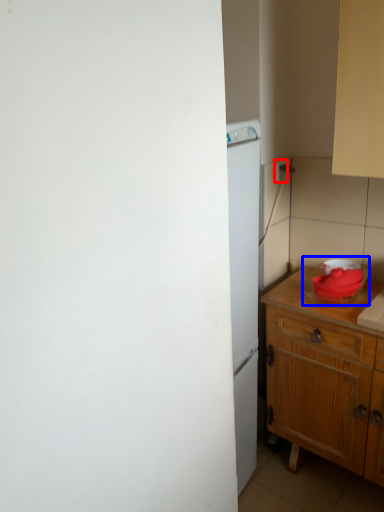
Question: Which object is closer to the camera taking this photo, electric outlet (highlighted by a red box) or appliance (highlighted by a blue box)?

Choices:
 (A) electric outlet
 (B) appliance

Answer: (B)